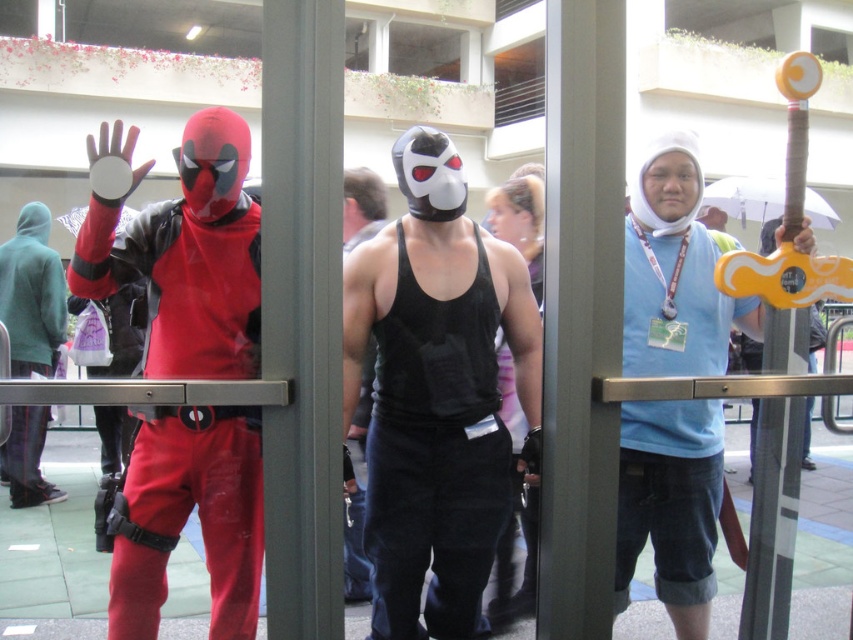
Question: Which point is closer to the camera?

Choices:
 (A) (486, 355)
 (B) (12, 465)
 (C) (659, 266)
 (D) (207, 449)

Answer: (D)

Question: From the image, what is the correct spatial relationship of black matte tank top at center in relation to matte red costume at left?

Choices:
 (A) left
 (B) right

Answer: (B)

Question: Does matte red costume at left lie in front of blue fabric shirt at center?

Choices:
 (A) yes
 (B) no

Answer: (A)

Question: Among these points, which one is nearest to the camera?

Choices:
 (A) (184, 349)
 (B) (508, 508)
 (C) (0, 272)
 (D) (635, 264)

Answer: (A)

Question: Does black matte tank top at center appear under matte black hoodie at left?

Choices:
 (A) no
 (B) yes

Answer: (B)

Question: Among these points, which one is nearest to the camera?

Choices:
 (A) (39, 419)
 (B) (706, 620)
 (C) (415, 449)

Answer: (C)